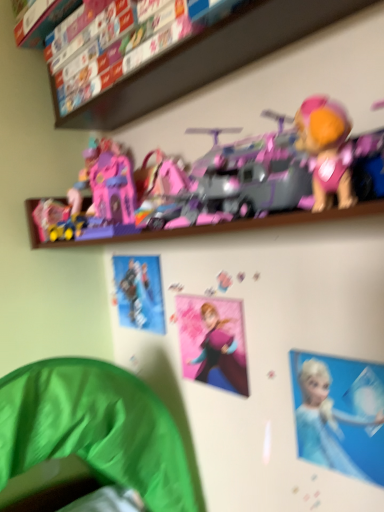
Question: Based on their positions, is pink plastic toys at upper center located to the left or right of pink matte anna poster at center, the first toy in the bottom-to-top sequence?

Choices:
 (A) left
 (B) right

Answer: (A)

Question: Is pink plastic toys at upper center wider or thinner than pink matte anna poster at center, the first toy in the bottom-to-top sequence?

Choices:
 (A) wide
 (B) thin

Answer: (A)

Question: Considering the real-world distances, which object is closest to the blue glossy poster at upper center, arranged as the 1th person when viewed from the right?

Choices:
 (A) pink plastic toys at upper center
 (B) metallic silver figure at upper center, which ranks as the 1th person in top-to-bottom order
 (C) pink plastic castle at upper center, acting as the second toy starting from the bottom
 (D) pink matte anna poster at center, which is counted as the second toy, starting from the top

Answer: (D)

Question: Which of these objects is positioned farthest from the pink matte anna poster at center, the first toy in the bottom-to-top sequence?

Choices:
 (A) pink plastic toys at upper center
 (B) blue glossy poster at upper center, arranged as the 1th person when viewed from the right
 (C) pink plastic castle at upper center, acting as the second toy starting from the bottom
 (D) metallic silver figure at upper center, which ranks as the 1th person in top-to-bottom order

Answer: (A)